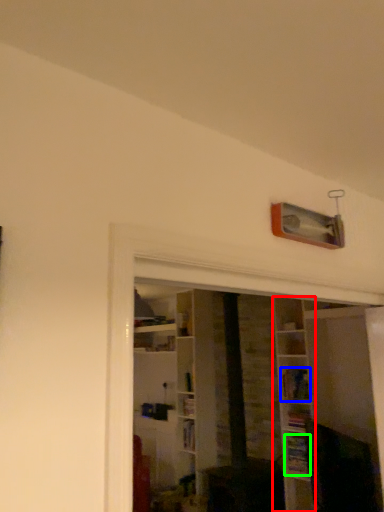
Question: Considering the real-world distances, which object is farthest from shelf (highlighted by a red box)? book (highlighted by a blue box) or book (highlighted by a green box)?

Choices:
 (A) book
 (B) book

Answer: (B)